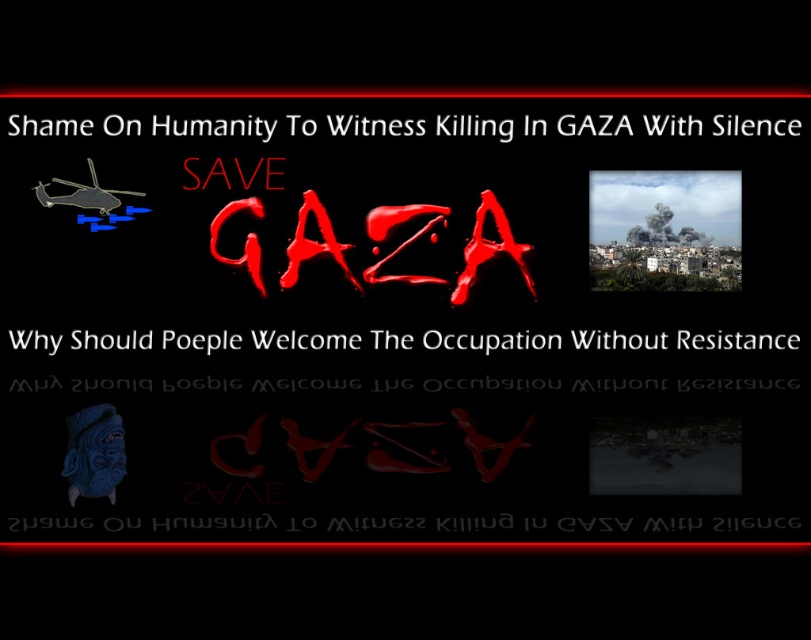
Consider the image. Does smokematerial/texture at upper right have a greater height compared to white text at center?

Indeed, smokematerial/texture at upper right has a greater height compared to white text at center.

Can you confirm if smokematerial/texture at upper right is shorter than white text at center?

No, smokematerial/texture at upper right is not shorter than white text at center.

Does point (696, 186) come in front of point (551, 333)?

No.

Find the location of a particular element. The width and height of the screenshot is (811, 640). smokematerial/texture at upper right is located at coordinates (664, 230).

Is blood-like text save gaza at center below white text at center?

No.

Does blood-like text save gaza at center have a larger size compared to white text at center?

Indeed, blood-like text save gaza at center has a larger size compared to white text at center.

Between point (413, 365) and point (663, 337), which one is positioned in front?

Point (413, 365) is in front.

The image size is (811, 640). What are the coordinates of `blood-like text save gaza at center` in the screenshot? It's located at (404, 317).

Which is more to the left, white text at center or dripping blood text at center?

From the viewer's perspective, dripping blood text at center appears more on the left side.

Who is higher up, white text at center or dripping blood text at center?

dripping blood text at center

Locate an element on the screen. white text at center is located at coordinates (406, 340).